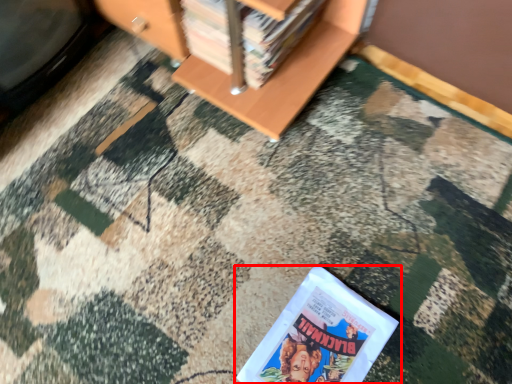
Question: Where is book (annotated by the red box) located in relation to book in the image?

Choices:
 (A) right
 (B) left

Answer: (A)